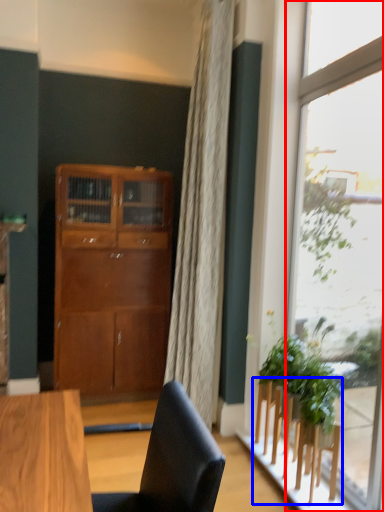
Question: Which of the following is the closest to the observer, window (highlighted by a red box) or furniture (highlighted by a blue box)?

Choices:
 (A) window
 (B) furniture

Answer: (A)